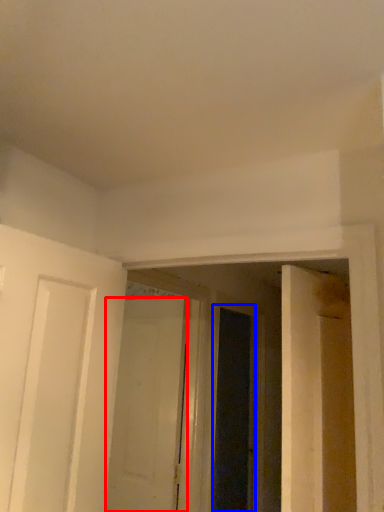
Question: Which point is closer to the camera, door (highlighted by a red box) or screen door (highlighted by a blue box)?

Choices:
 (A) door
 (B) screen door

Answer: (A)